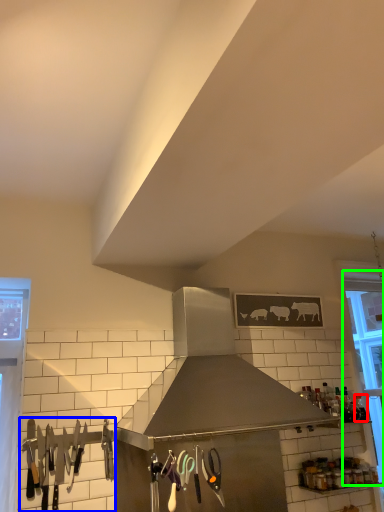
Question: Which object is the farthest from bottle (highlighted by a red box)? Choose among these: silverware (highlighted by a blue box) or window (highlighted by a green box).

Choices:
 (A) silverware
 (B) window

Answer: (A)